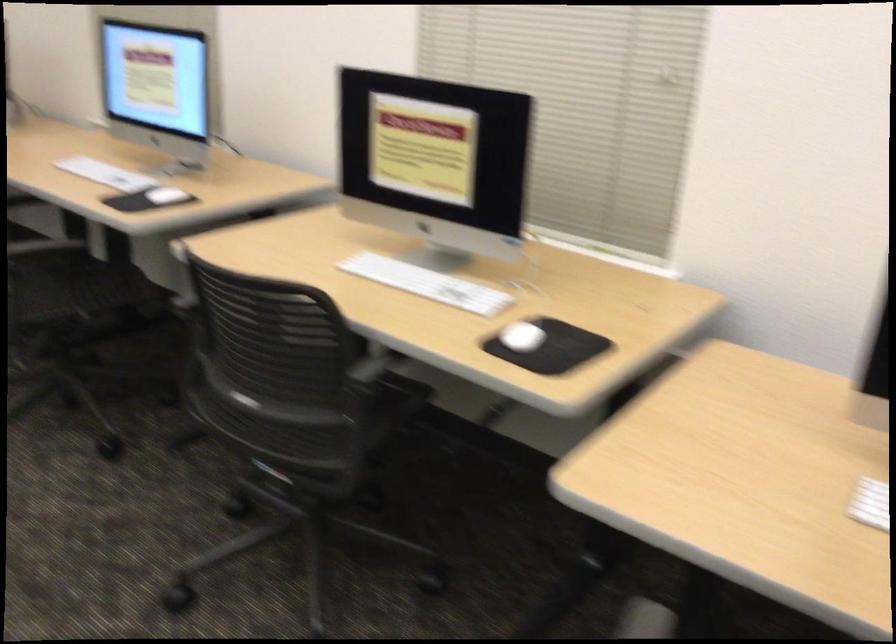
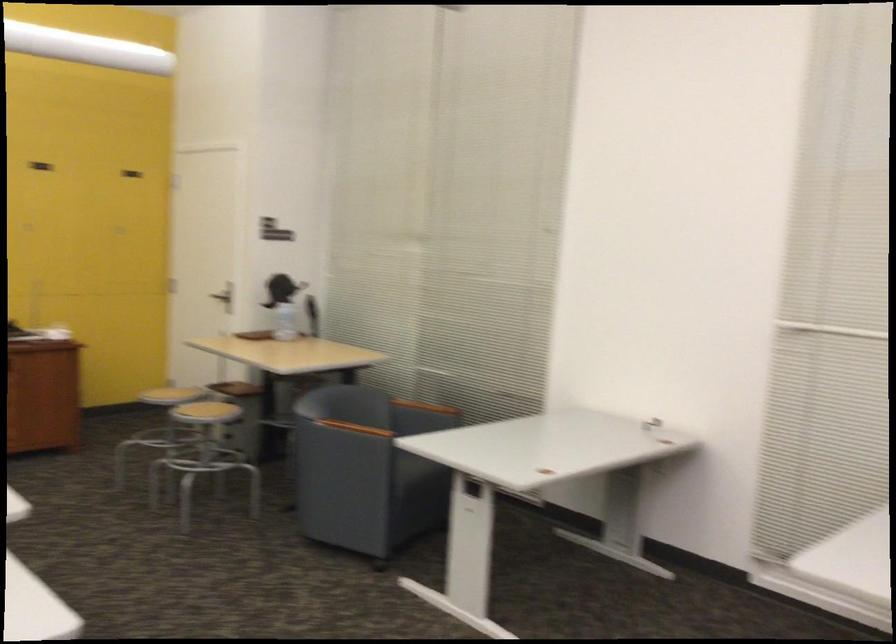
Question: The camera is either moving clockwise (left) or counter-clockwise (right) around the object. The first image is from the beginning of the video and the second image is from the end. Is the camera moving left or right when shooting the video?

Choices:
 (A) Left
 (B) Right

Answer: (B)